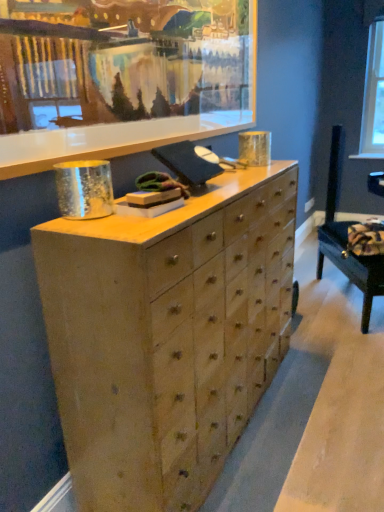
Question: Does velvet dark blue swivel chair at lower right contain wooden picture frame at upper center?

Choices:
 (A) yes
 (B) no

Answer: (B)

Question: From a real-world perspective, is velvet dark blue swivel chair at lower right physically below wooden picture frame at upper center?

Choices:
 (A) no
 (B) yes

Answer: (B)

Question: Can you confirm if velvet dark blue swivel chair at lower right is taller than wooden picture frame at upper center?

Choices:
 (A) no
 (B) yes

Answer: (A)

Question: Is velvet dark blue swivel chair at lower right oriented towards wooden picture frame at upper center?

Choices:
 (A) no
 (B) yes

Answer: (A)

Question: Is velvet dark blue swivel chair at lower right not inside wooden picture frame at upper center?

Choices:
 (A) yes
 (B) no

Answer: (A)

Question: Is velvet dark blue swivel chair at lower right positioned behind wooden picture frame at upper center?

Choices:
 (A) no
 (B) yes

Answer: (B)

Question: Is clear glass window screen at upper right surrounded by wooden picture frame at upper center?

Choices:
 (A) yes
 (B) no

Answer: (B)

Question: From the image's perspective, is wooden picture frame at upper center under clear glass window screen at upper right?

Choices:
 (A) no
 (B) yes

Answer: (B)

Question: Is clear glass window screen at upper right at the back of wooden picture frame at upper center?

Choices:
 (A) yes
 (B) no

Answer: (B)

Question: Does wooden picture frame at upper center have a lesser height compared to clear glass window screen at upper right?

Choices:
 (A) no
 (B) yes

Answer: (B)

Question: Is wooden picture frame at upper center not within clear glass window screen at upper right?

Choices:
 (A) yes
 (B) no

Answer: (A)

Question: Can you confirm if wooden picture frame at upper center is positioned to the left of clear glass window screen at upper right?

Choices:
 (A) yes
 (B) no

Answer: (A)

Question: Is clear glass window screen at upper right completely or partially outside of velvet dark blue swivel chair at lower right?

Choices:
 (A) no
 (B) yes

Answer: (B)